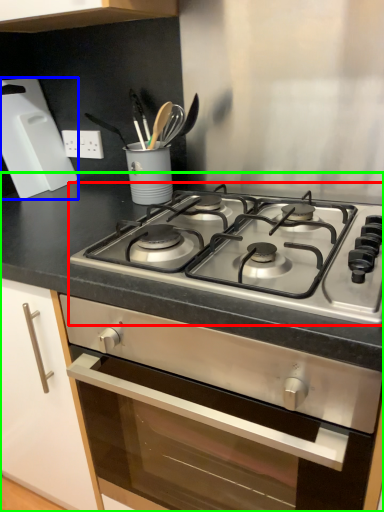
Question: Which object is the farthest from gas stove (highlighted by a red box)? Choose among these: kitchen appliance (highlighted by a blue box) or countertop (highlighted by a green box).

Choices:
 (A) kitchen appliance
 (B) countertop

Answer: (A)